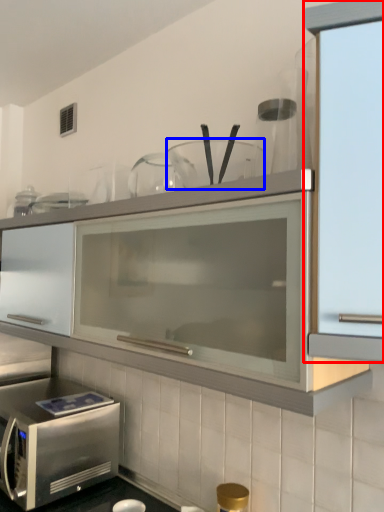
Question: Which object appears farthest to the camera in this image, cabinetry (highlighted by a red box) or tableware (highlighted by a blue box)?

Choices:
 (A) cabinetry
 (B) tableware

Answer: (B)